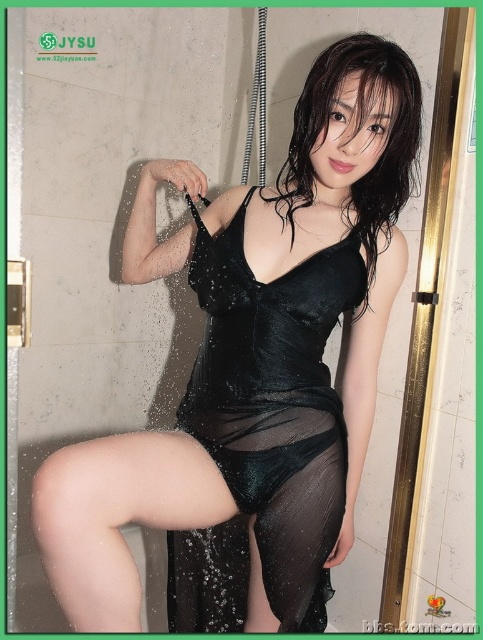
Question: Which object is farther from the camera taking this photo?

Choices:
 (A) black sheer skirt at lower center
 (B) black sheer dress at center
 (C) satin black dress at center

Answer: (A)

Question: Which object is farther from the camera taking this photo?

Choices:
 (A) satin black dress at center
 (B) black sheer dress at center

Answer: (B)

Question: Does black sheer dress at center have a greater width compared to satin black dress at center?

Choices:
 (A) no
 (B) yes

Answer: (B)

Question: Estimate the real-world distances between objects in this image. Which object is closer to the satin black dress at center?

Choices:
 (A) black sheer skirt at lower center
 (B) black sheer dress at center

Answer: (B)

Question: Is black sheer dress at center further to the viewer compared to satin black dress at center?

Choices:
 (A) no
 (B) yes

Answer: (B)

Question: Does black sheer dress at center appear under black sheer skirt at lower center?

Choices:
 (A) yes
 (B) no

Answer: (B)